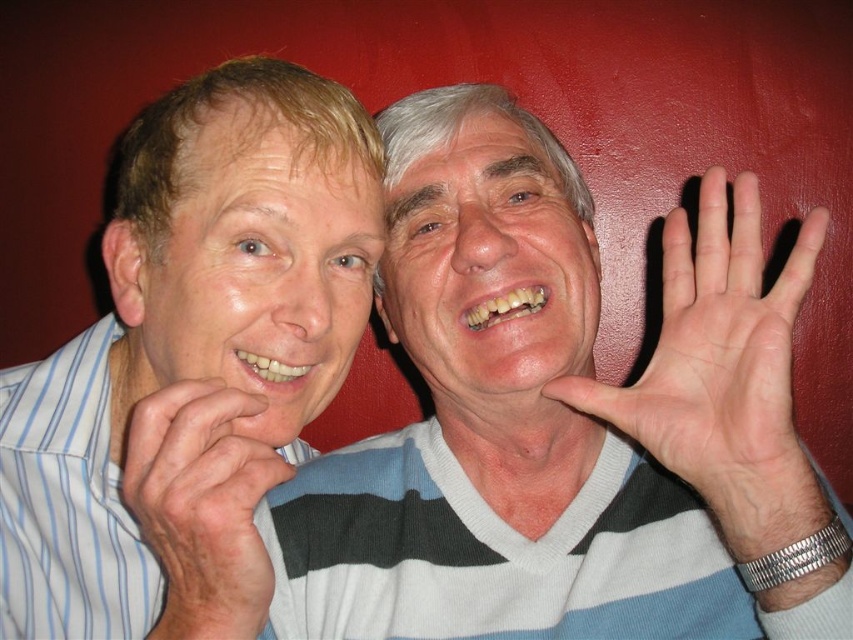
You are trying to decide which item to take for a casual day out. Both the white striped sweater at center and the white striped shirt at left are available. Based on their positions in the image, which one is closer to the bottom of the image?

The white striped sweater at center is located below the white striped shirt at left, so the white striped sweater at center is closer to the bottom of the image.

You are a photographer trying to capture a clear shot of the smooth skin face at center without the matte white face at left blocking it. Can you adjust your position to do so?

The matte white face at left is in front of the smooth skin face at center, so you cannot capture a clear shot of the smooth skin face at center without moving the matte white face at left out of the way.

You are a photographer who wants to capture a closeup shot of both the white striped sweater at center and the white striped shirt at left. The camera you are using has a lens that can focus on objects within a 15 cm range. Can you fit both items into the frame without moving the camera?

The white striped sweater at center and the white striped shirt at left are 14.67 centimeters apart from each other, so yes, they can both fit within the camera lens range of 15 cm.